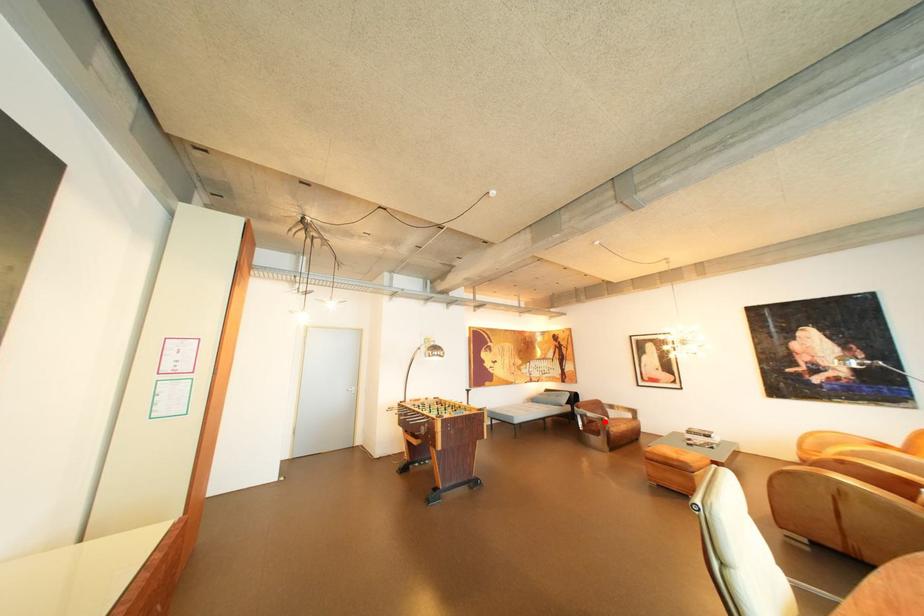
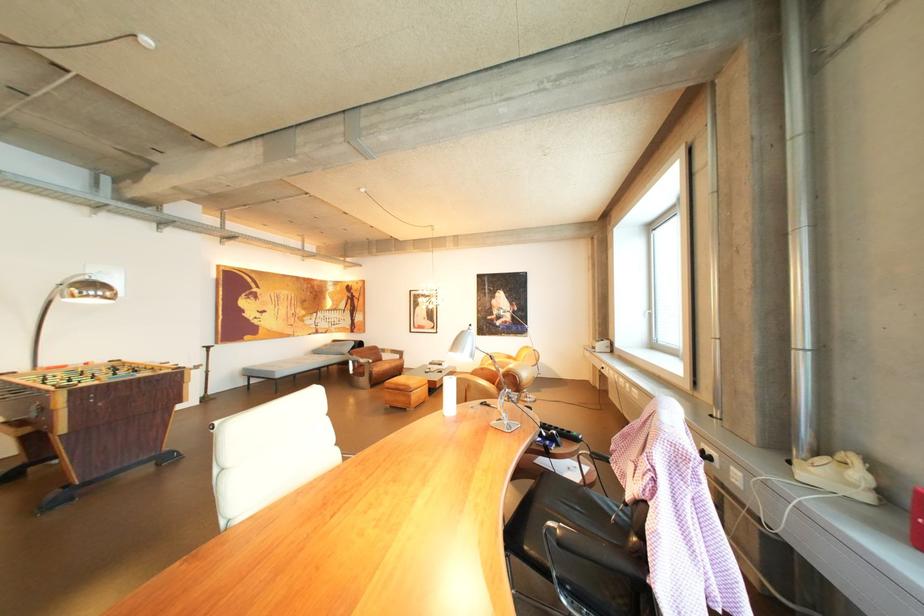
Locate, in the second image, the point that corresponds to the highlighted location in the first image.

(374, 366)